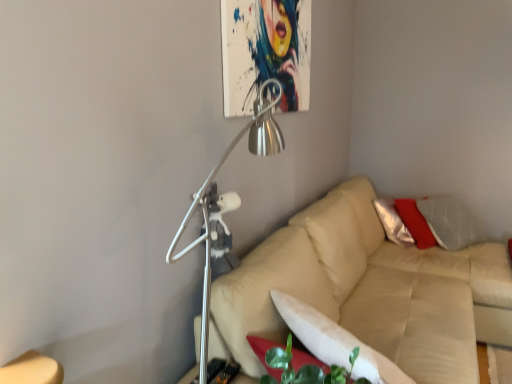
Question: Is point tap(205, 200) positioned closer to the camera than point tap(394, 379)?

Choices:
 (A) farther
 (B) closer

Answer: (A)

Question: Is metallic silver lamp at upper center taller or shorter than white soft pillow at lower center?

Choices:
 (A) short
 (B) tall

Answer: (B)

Question: Which is nearer to the beige leather couch at center?

Choices:
 (A) metallic silver lamp at upper center
 (B) white soft pillow at lower center

Answer: (B)

Question: Which of these objects is positioned closest to the metallic silver lamp at upper center?

Choices:
 (A) beige leather couch at center
 (B) white soft pillow at lower center

Answer: (B)